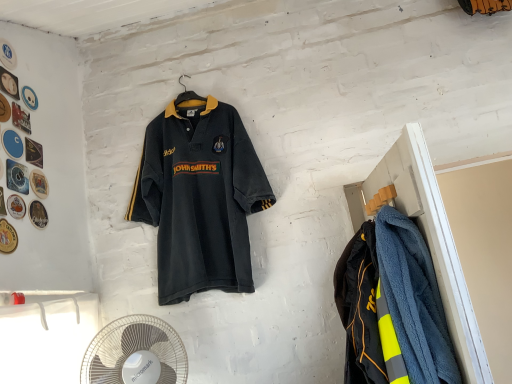
Question: Considering the relative sizes of dark gray jersey at center and blue fuzzy coat at right in the image provided, is dark gray jersey at center smaller than blue fuzzy coat at right?

Choices:
 (A) yes
 (B) no

Answer: (B)

Question: Considering the relative positions of dark gray jersey at center and blue fuzzy coat at right in the image provided, is dark gray jersey at center to the right of blue fuzzy coat at right from the viewer's perspective?

Choices:
 (A) no
 (B) yes

Answer: (A)

Question: From the image's perspective, is dark gray jersey at center beneath blue fuzzy coat at right?

Choices:
 (A) yes
 (B) no

Answer: (B)

Question: Can you confirm if dark gray jersey at center is positioned to the left of blue fuzzy coat at right?

Choices:
 (A) yes
 (B) no

Answer: (A)

Question: From a real-world perspective, is dark gray jersey at center under blue fuzzy coat at right?

Choices:
 (A) yes
 (B) no

Answer: (B)

Question: Does point (484, 362) appear closer or farther from the camera than point (207, 264)?

Choices:
 (A) closer
 (B) farther

Answer: (A)

Question: From the image's perspective, is blue fuzzy coat at right positioned above or below dark gray jersey at center?

Choices:
 (A) above
 (B) below

Answer: (B)

Question: Is blue fuzzy coat at right in front of or behind dark gray jersey at center in the image?

Choices:
 (A) behind
 (B) front

Answer: (B)

Question: Looking at the image, does blue fuzzy coat at right seem bigger or smaller compared to dark gray jersey at center?

Choices:
 (A) big
 (B) small

Answer: (B)

Question: Relative to dark gray jersey at center, is white plastic fan at lower left in front or behind?

Choices:
 (A) front
 (B) behind

Answer: (A)

Question: From a real-world perspective, is white plastic fan at lower left above or below dark gray jersey at center?

Choices:
 (A) below
 (B) above

Answer: (A)

Question: In terms of width, does white plastic fan at lower left look wider or thinner when compared to dark gray jersey at center?

Choices:
 (A) thin
 (B) wide

Answer: (A)

Question: Is white plastic fan at lower left inside or outside of dark gray jersey at center?

Choices:
 (A) inside
 (B) outside

Answer: (B)

Question: From a real-world perspective, relative to dark gray jersey at center, is neon yellow reflective jacket at right vertically above or below?

Choices:
 (A) below
 (B) above

Answer: (A)

Question: From the image's perspective, is neon yellow reflective jacket at right positioned above or below dark gray jersey at center?

Choices:
 (A) above
 (B) below

Answer: (B)